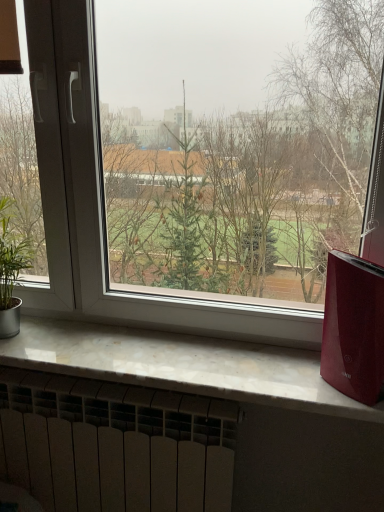
Where is `vacant space situated on the left part of shiny red air purifier at right`? vacant space situated on the left part of shiny red air purifier at right is located at coordinates (277, 379).